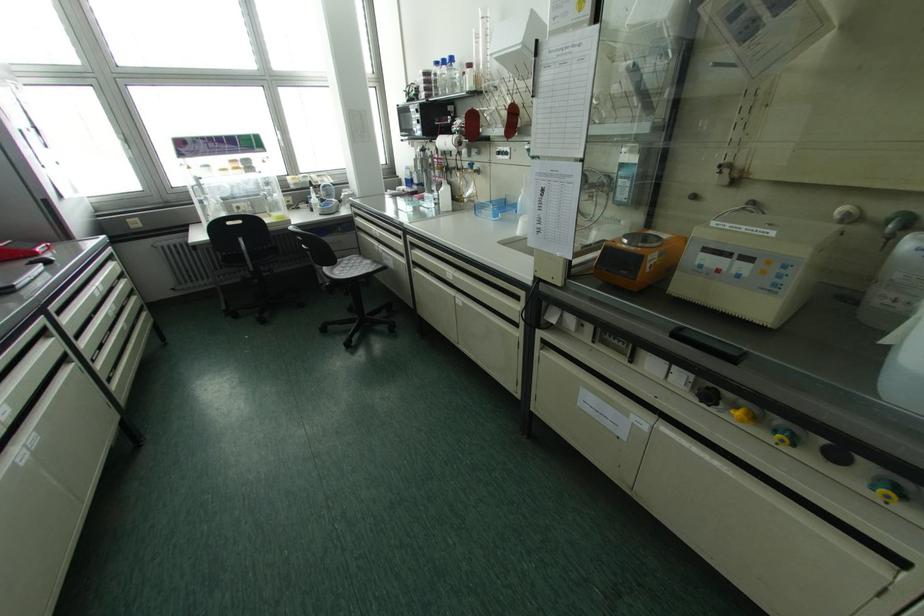
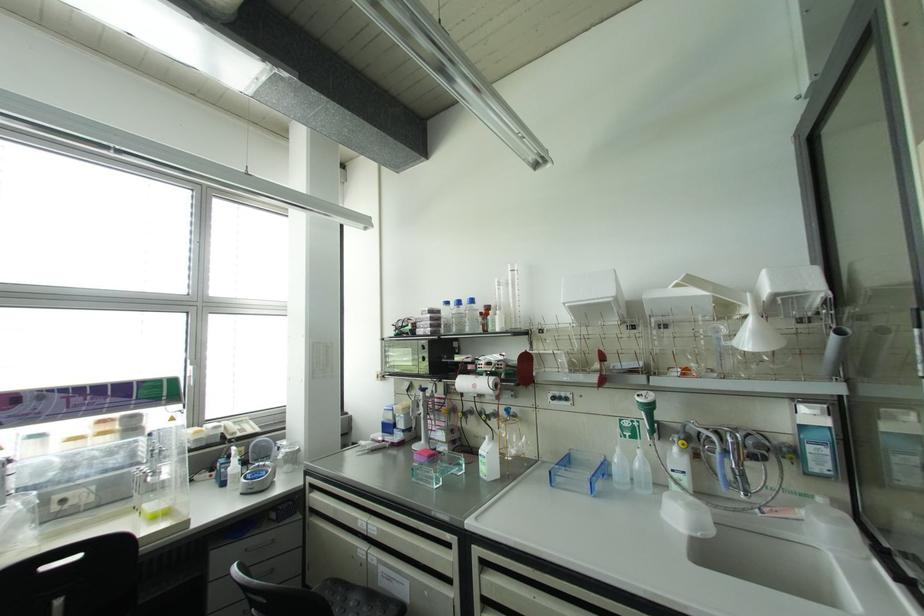
Locate, in the second image, the point that corresponds to point 451,59 in the first image.

(471, 301)